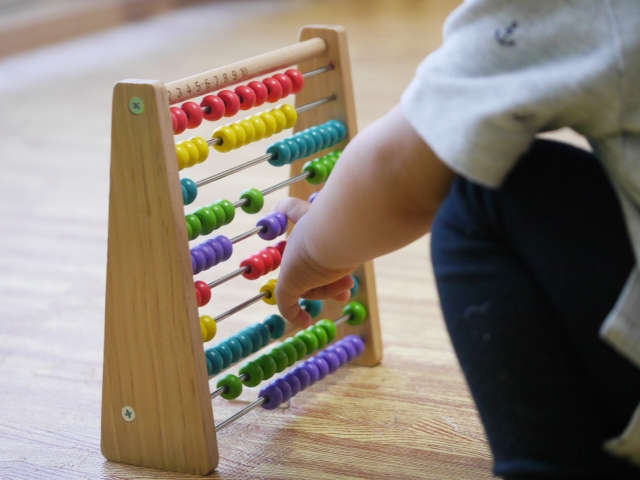
Locate an element on the screen. rods is located at coordinates (314, 72), (314, 104), (249, 161), (289, 180), (241, 236), (227, 276), (244, 301), (304, 307), (217, 391), (232, 419).